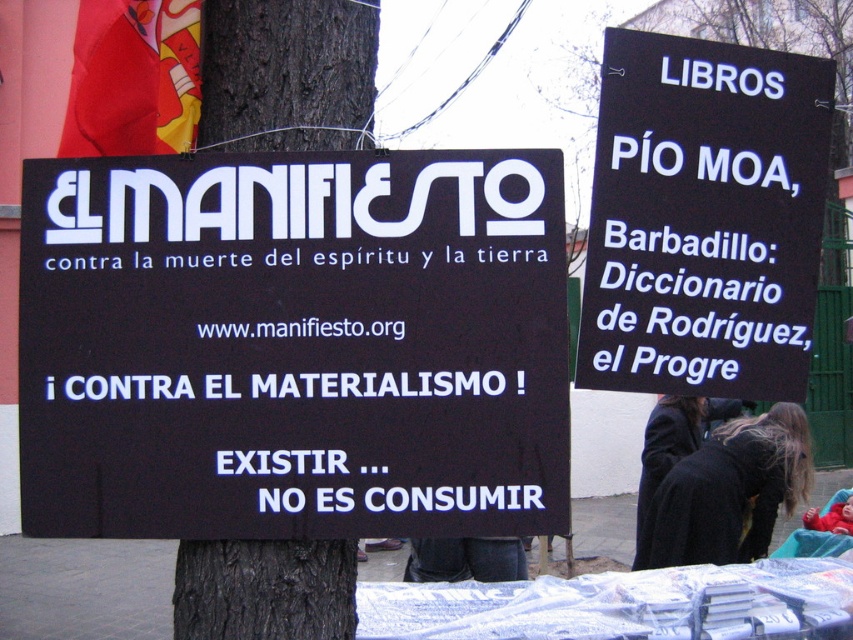
Between black paper sign at upper right and denim pants at lower center, which one appears on the right side from the viewer's perspective?

black paper sign at upper right

Locate an element on the screen. This screenshot has height=640, width=853. black paper sign at upper right is located at coordinates (704, 218).

Which is in front, point (692, 314) or point (497, 554)?

Point (692, 314) is in front.

This screenshot has width=853, height=640. What are the coordinates of `black paper sign at upper right` in the screenshot? It's located at (704, 218).

Is black matte sign at center shorter than denim pants at lower center?

In fact, black matte sign at center may be taller than denim pants at lower center.

Is point (138, 428) positioned in front of point (494, 570)?

Yes, it is.

This screenshot has width=853, height=640. What are the coordinates of `black matte sign at center` in the screenshot? It's located at (293, 344).

Is black wool coat at lower right below denim pants at lower center?

Actually, black wool coat at lower right is above denim pants at lower center.

Between black wool coat at lower right and denim pants at lower center, which one is positioned lower?

denim pants at lower center

Which is behind, point (637, 564) or point (492, 554)?

The point (637, 564) is more distant.

Locate an element on the screen. Image resolution: width=853 pixels, height=640 pixels. black wool coat at lower right is located at coordinates (729, 492).